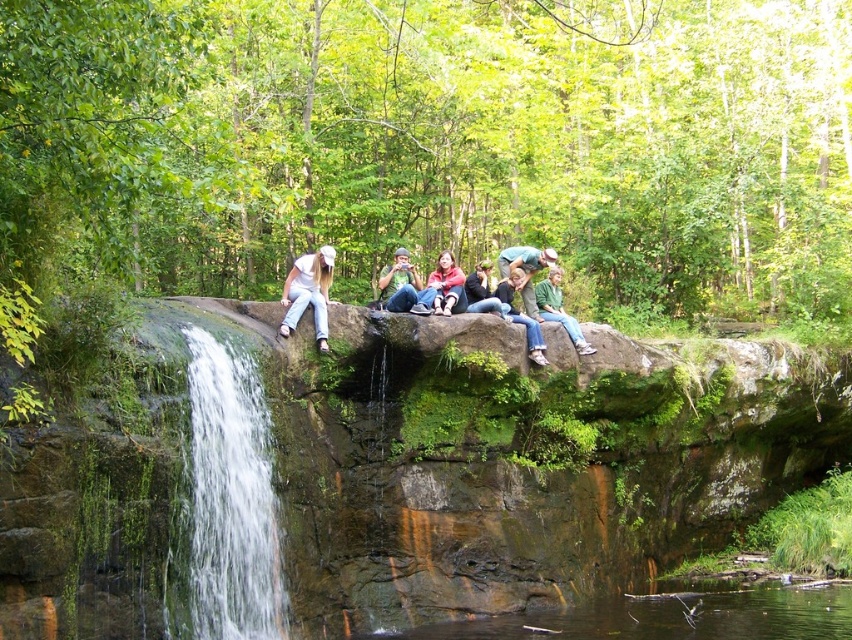
Question: Among these points, which one is nearest to the camera?

Choices:
 (A) (504, 262)
 (B) (419, 292)
 (C) (481, 296)

Answer: (B)

Question: Can you confirm if clear water at lower center is positioned to the right of matte pink sweater at center?

Choices:
 (A) no
 (B) yes

Answer: (B)

Question: Estimate the real-world distances between objects in this image. Which object is closer to the jeans at center?

Choices:
 (A) matte black jacket at center
 (B) white denim jeans at center

Answer: (A)

Question: Is white denim jeans at center above green matte jacket at center?

Choices:
 (A) no
 (B) yes

Answer: (B)

Question: Considering the real-world distances, which object is closest to the matte black jacket at center?

Choices:
 (A) matte blue jeans at center
 (B) jeans at center
 (C) clear water at lower center
 (D) matte pink sweater at center

Answer: (D)

Question: Is clear water at lower center wider than matte blue jeans at center?

Choices:
 (A) no
 (B) yes

Answer: (B)